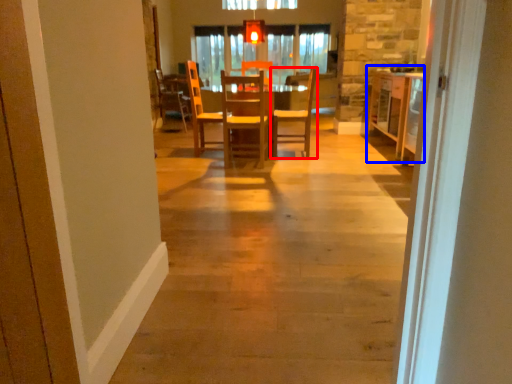
Question: Which of the following is the farthest to the observer, chair (highlighted by a red box) or table (highlighted by a blue box)?

Choices:
 (A) chair
 (B) table

Answer: (A)